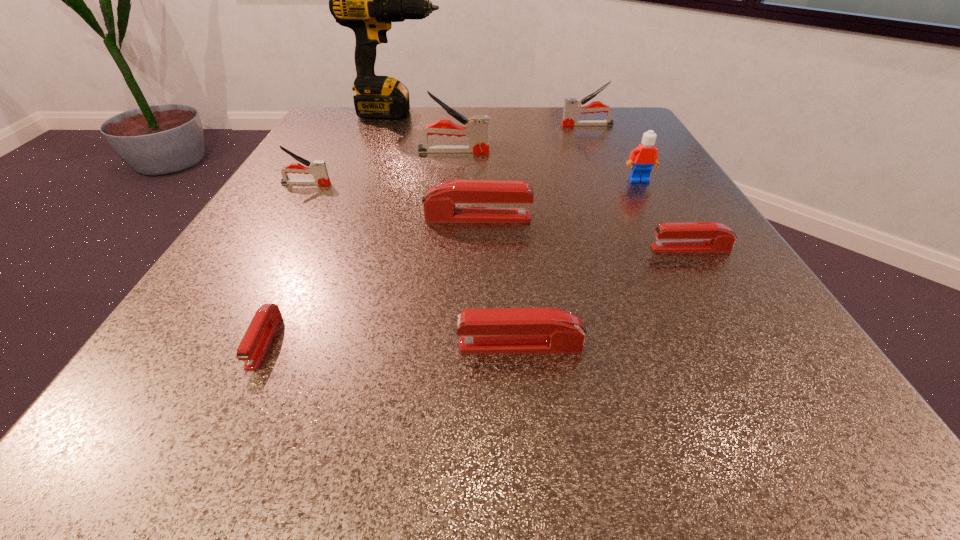
Identify the location of free location located on the front-facing side of the fifth farthest stapler. This screenshot has height=540, width=960. (562, 248).

This screenshot has width=960, height=540. In order to click on free space located 0.080m on the front-facing side of the leftmost red stapler in this screenshot , I will do `click(219, 435)`.

Image resolution: width=960 pixels, height=540 pixels. In order to click on drill at the far edge in this screenshot , I will do `click(366, 0)`.

I want to click on stapler that is at the far edge, so click(572, 107).

Find the location of `drill that is at the left edge`. drill that is at the left edge is located at coordinates (366, 0).

I want to click on Lego that is at the right edge, so pyautogui.click(x=642, y=158).

You are a GUI agent. You are given a task and a screenshot of the screen. Output one action in this format:
    pyautogui.click(x=<x>, y=<y>)
    Task: Click on the object that is at the far left corner
    The image size is (960, 540).
    Given the screenshot: What is the action you would take?
    pyautogui.click(x=366, y=0)

You are a GUI agent. You are given a task and a screenshot of the screen. Output one action in this format:
    pyautogui.click(x=<x>, y=<y>)
    Task: Click on the object that is at the far right corner
    The image size is (960, 540).
    Given the screenshot: What is the action you would take?
    pyautogui.click(x=572, y=107)

You are a GUI agent. You are given a task and a screenshot of the screen. Output one action in this format:
    pyautogui.click(x=<x>, y=<y>)
    Task: Click on the vacant space at the far edge of the desktop
    
    Given the screenshot: What is the action you would take?
    pyautogui.click(x=439, y=143)

Image resolution: width=960 pixels, height=540 pixels. I want to click on vacant space at the left edge of the desktop, so click(x=299, y=155).